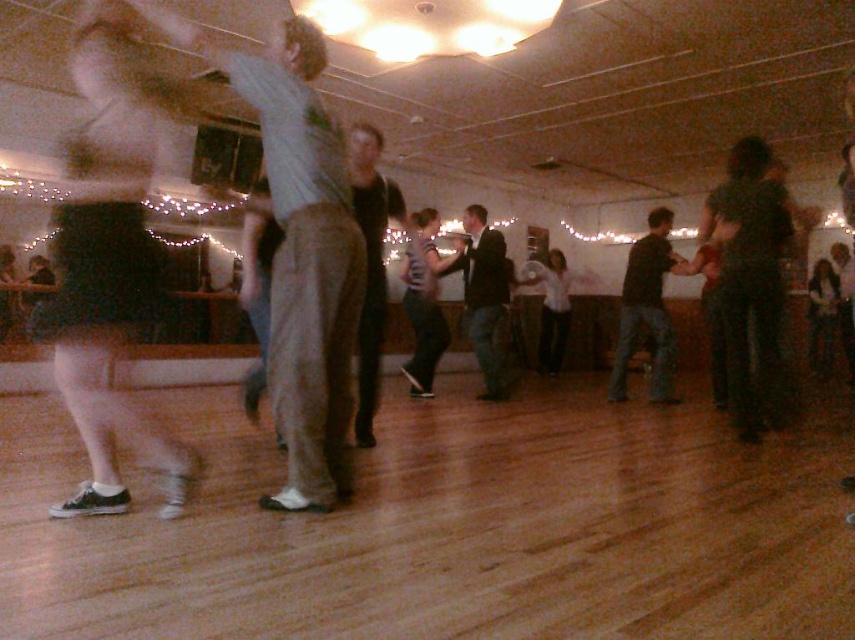
Is dark blue jeans at center shorter than white matte shirt at center?

Correct, dark blue jeans at center is not as tall as white matte shirt at center.

From the picture: Who is more distant from viewer, (617, 369) or (558, 308)?

Positioned behind is point (558, 308).

Which is behind, point (640, 240) or point (550, 301)?

Positioned behind is point (550, 301).

Find the location of a particular element. dark blue jeans at center is located at coordinates (646, 308).

Which is below, light gray cotton pants at center or dark gray pants at center?

Positioned lower is dark gray pants at center.

Who is positioned more to the right, light gray cotton pants at center or dark gray pants at center?

dark gray pants at center

Between point (345, 420) and point (369, 381), which one is positioned behind?

Point (369, 381)

At what (x,y) coordinates should I click in order to perform the action: click on light gray cotton pants at center. Please return your answer as a coordinate pair (x, y). The height and width of the screenshot is (640, 855). Looking at the image, I should click on (299, 250).

Is light gray cotton pants at center to the right of white matte shirt at center from the viewer's perspective?

Incorrect, light gray cotton pants at center is not on the right side of white matte shirt at center.

Does point (275, 362) come farther from viewer compared to point (546, 349)?

No, it is not.

Where is `light gray cotton pants at center`? light gray cotton pants at center is located at coordinates (299, 250).